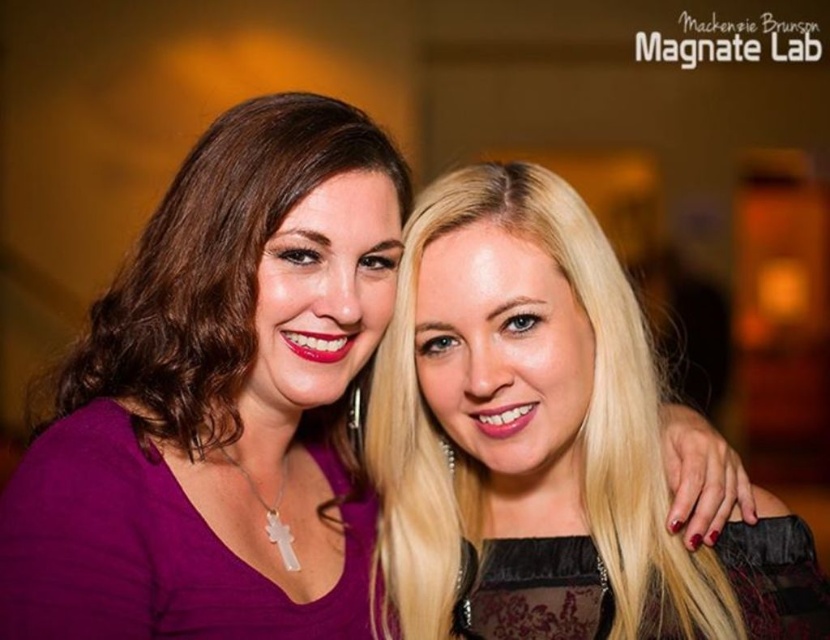
Which is more to the right, blonde hair at right or matte purple blouse at left?

Positioned to the right is blonde hair at right.

Does blonde hair at right have a greater height compared to matte purple blouse at left?

Correct, blonde hair at right is much taller as matte purple blouse at left.

Between point (491, 620) and point (304, 156), which one is positioned behind?

Positioned behind is point (491, 620).

At what (x,y) coordinates should I click in order to perform the action: click on blonde hair at right. Please return your answer as a coordinate pair (x, y). The height and width of the screenshot is (640, 830). Looking at the image, I should click on (545, 444).